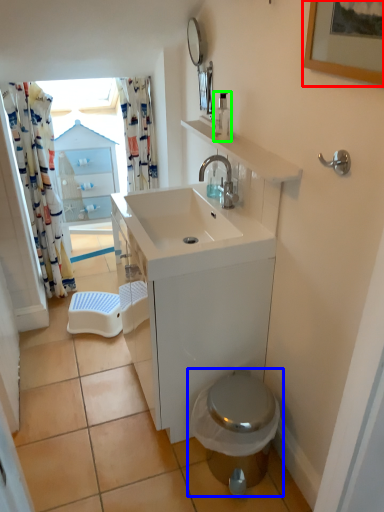
Question: Based on their relative distances, which object is farther from picture frame (highlighted by a red box)? Choose from toilet (highlighted by a blue box) and soap dispenser (highlighted by a green box).

Choices:
 (A) toilet
 (B) soap dispenser

Answer: (A)